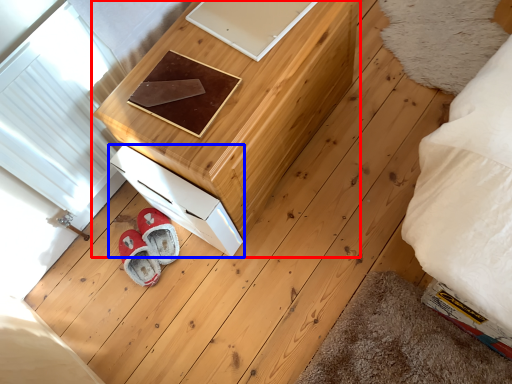
Question: Which of the following is the farthest to the observer, furniture (highlighted by a red box) or drawer (highlighted by a blue box)?

Choices:
 (A) furniture
 (B) drawer

Answer: (B)